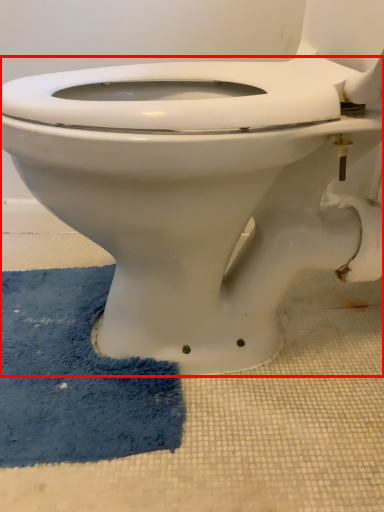
Question: From the image's perspective, considering the relative positions of toilet (annotated by the red box) and bath mat in the image provided, where is toilet (annotated by the red box) located with respect to the staircase?

Choices:
 (A) above
 (B) below

Answer: (A)